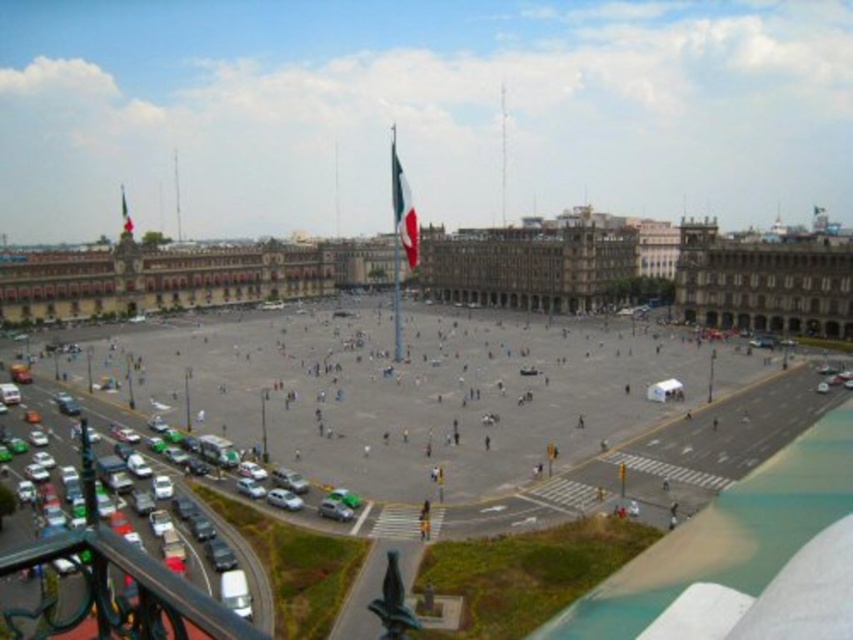
Question: Observing the image, what is the correct spatial positioning of brown stone building at center in reference to green fabric flag at upper center?

Choices:
 (A) below
 (B) above

Answer: (A)

Question: Among these points, which one is farthest from the camera?

Choices:
 (A) (416, 256)
 (B) (123, 209)
 (C) (848, 260)

Answer: (B)

Question: Does smooth concrete plaza at center have a larger size compared to green fabric flag at upper center?

Choices:
 (A) no
 (B) yes

Answer: (B)

Question: Observing the image, what is the correct spatial positioning of red fabric flag at center in reference to green fabric flag at upper center?

Choices:
 (A) above
 (B) below

Answer: (B)

Question: Which object appears farthest from the camera in this image?

Choices:
 (A) green fabric flag at upper center
 (B) smooth concrete plaza at center
 (C) red fabric flag at center
 (D) brown stone building at center

Answer: (A)

Question: Among these objects, which one is farthest from the camera?

Choices:
 (A) smooth concrete plaza at center
 (B) green fabric flag at upper center

Answer: (B)